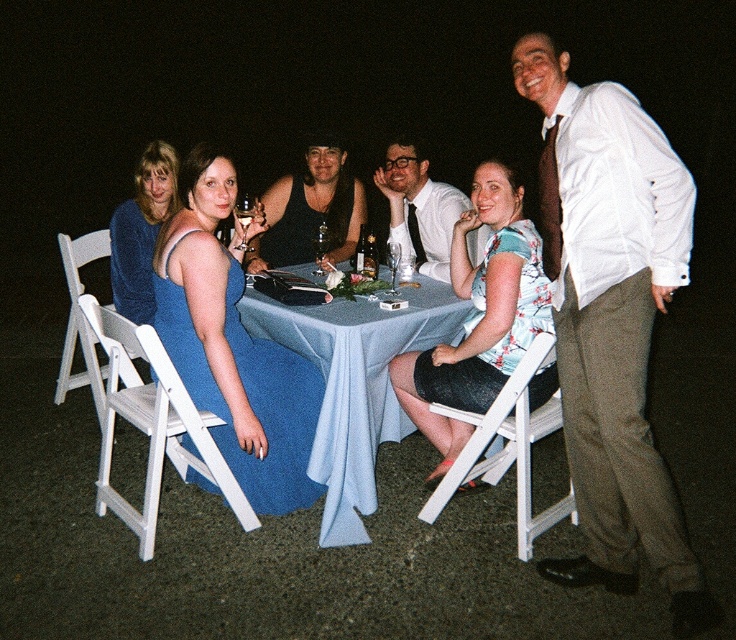
You are taking a photo of the group and want to ensure both the point at (289, 330) and the point at (435, 189) are in focus. Since you can only focus on one point, which point should you choose to maximize the chances of both being in focus?

You should focus on point (435, 189) because it is farther from the camera, and focusing on the farther point will keep the closer point also in focus due to depth of field.

You are a photographer at the event and need to capture a photo of both the matte blue dress at left and the floral fabric dress at center. Based on their positions, which dress is closer to the camera?

The floral fabric dress at center is closer to the camera because the matte blue dress at left is positioned below it, indicating it is further away.